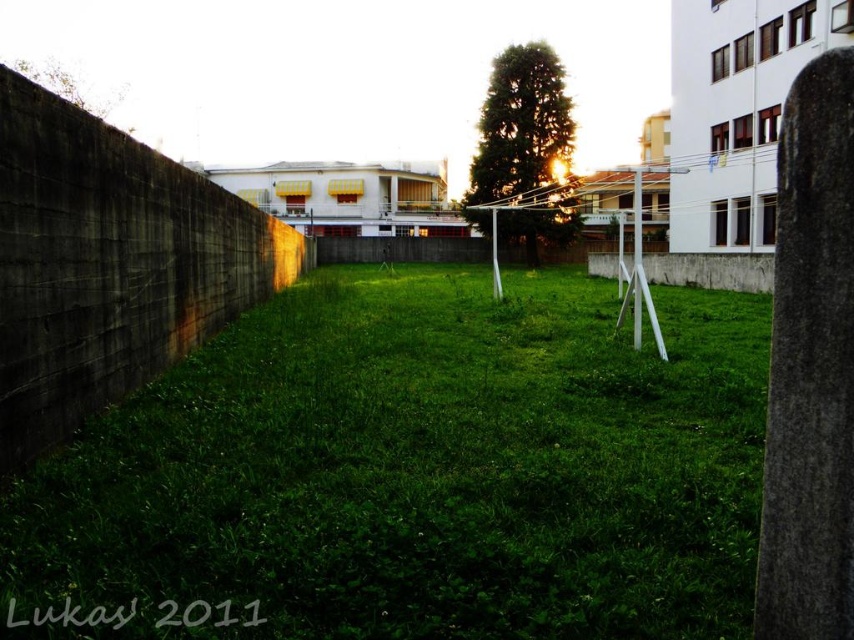
Can you confirm if green grassy at center is bigger than gray concrete wall at left?

No.

Which is more to the right, green grassy at center or gray concrete wall at left?

green grassy at center

Between point (79, 461) and point (151, 332), which one is positioned behind?

The point (151, 332) is behind.

The width and height of the screenshot is (854, 640). What are the coordinates of `green grassy at center` in the screenshot? It's located at (413, 472).